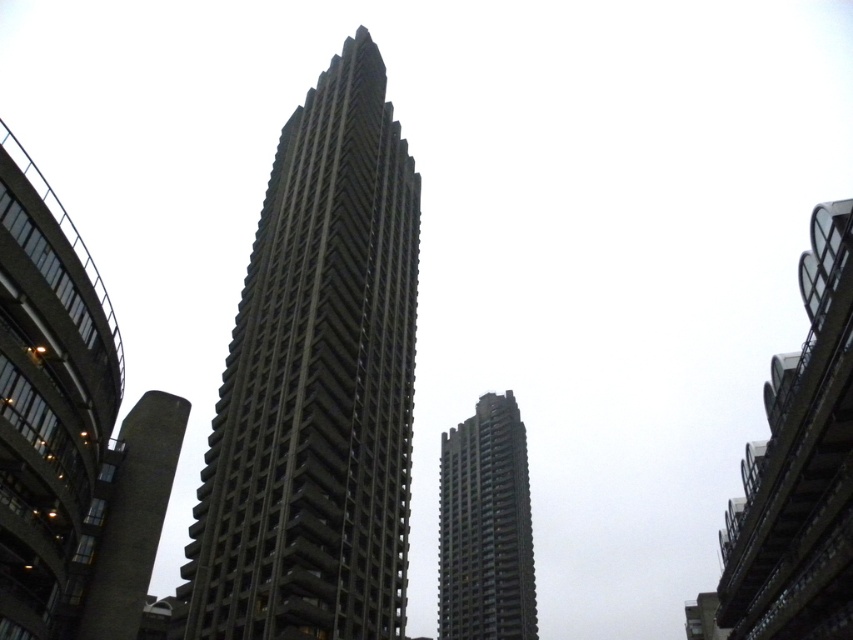
Question: Is gray concrete tower at center bigger than dark gray concrete tower at center?

Choices:
 (A) no
 (B) yes

Answer: (B)

Question: Is concrete textured building at center smaller than dark gray concrete tower at center?

Choices:
 (A) yes
 (B) no

Answer: (A)

Question: Which object is farther from the camera taking this photo?

Choices:
 (A) gray concrete tower at center
 (B) concrete textured building at center

Answer: (A)

Question: Does concrete textured building at center appear on the right side of dark gray concrete tower at center?

Choices:
 (A) no
 (B) yes

Answer: (A)

Question: Among these points, which one is farthest from the camera?

Choices:
 (A) (241, 385)
 (B) (492, 442)
 (C) (132, 412)

Answer: (B)

Question: Which point is farther from the camera taking this photo?

Choices:
 (A) (3, 449)
 (B) (471, 538)

Answer: (B)